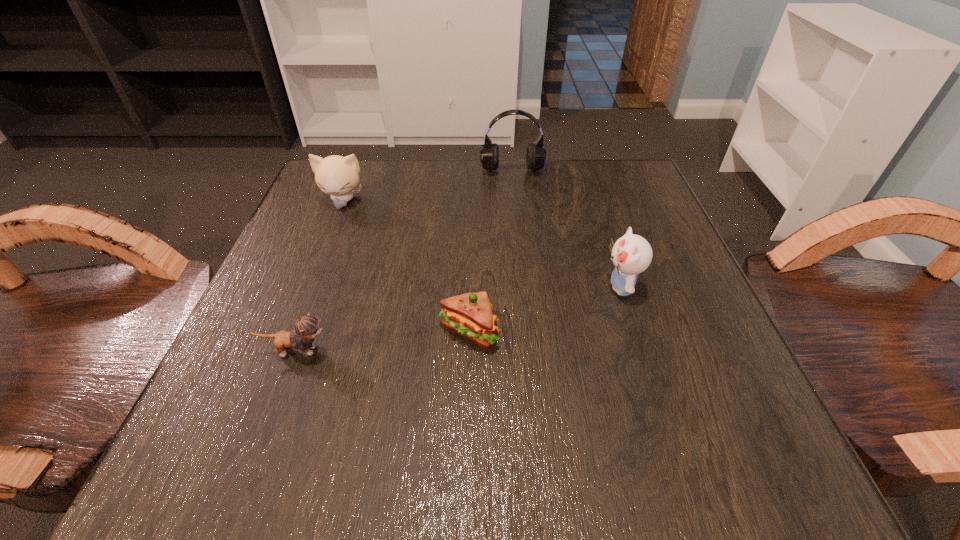
Find the location of a particular element. The width and height of the screenshot is (960, 540). object that stands as the fourth closest to the shortest kitten is located at coordinates (535, 155).

Locate which kitten is the second closest to the shortest kitten. Please provide its 2D coordinates. Your answer should be formatted as a tuple, i.e. [(x, y)], where the tuple contains the x and y coordinates of a point satisfying the conditions above.

[(632, 254)]

Point out which kitten is positioned as the second nearest to the tallest object. Please provide its 2D coordinates. Your answer should be formatted as a tuple, i.e. [(x, y)], where the tuple contains the x and y coordinates of a point satisfying the conditions above.

[(335, 175)]

I want to click on free location that satisfies the following two spatial constraints: 1. on the face of the sandwich; 2. on the left side of the farthest kitten, so click(292, 332).

Locate an element on the screen. The image size is (960, 540). vacant space that satisfies the following two spatial constraints: 1. on the face of the farthest kitten; 2. on the left side of the sandwich is located at coordinates (292, 332).

Where is `free space that satisfies the following two spatial constraints: 1. on the face of the farthest kitten; 2. on the right side of the sandwich`? free space that satisfies the following two spatial constraints: 1. on the face of the farthest kitten; 2. on the right side of the sandwich is located at coordinates (292, 332).